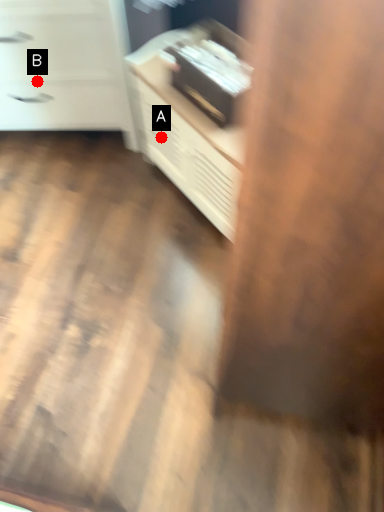
Question: Two points are circled on the image, labeled by A and B beside each circle. Which point is closer to the camera?

Choices:
 (A) A is closer
 (B) B is closer

Answer: (B)